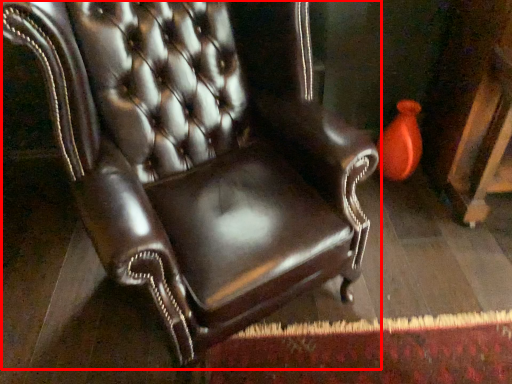
Question: From the image's perspective, where is chair (annotated by the red box) located relative to vase?

Choices:
 (A) above
 (B) below

Answer: (B)